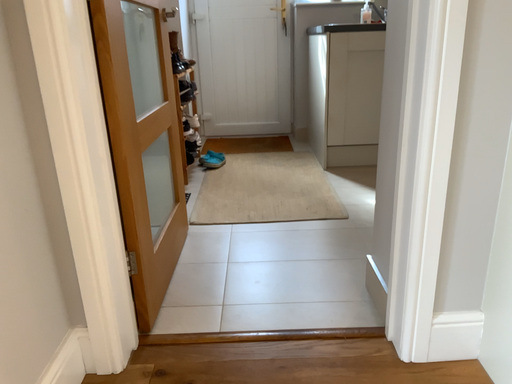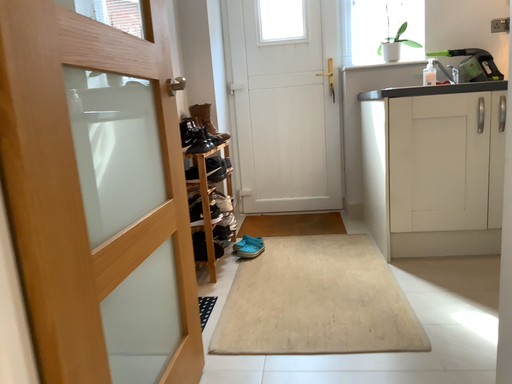
Question: Which way did the camera rotate in the video?

Choices:
 (A) rotated upward
 (B) rotated downward

Answer: (A)